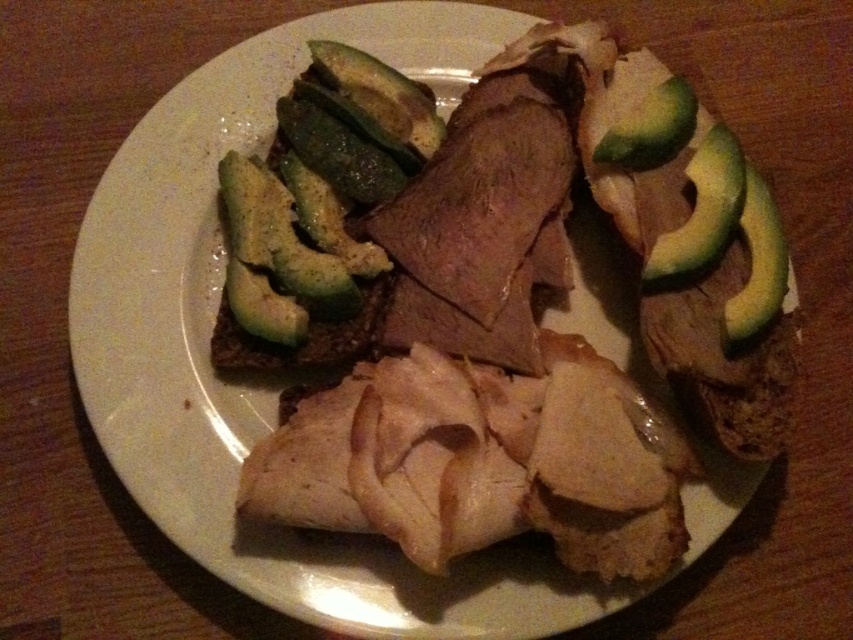
You are a food stylist arranging this plate. You need to place a new garnish between the green smooth avocado at upper right and the green smooth avocado at right. Which avocado is shorter so you can place the garnish in front of it?

The green smooth avocado at upper right is shorter than the green smooth avocado at right, so you should place the garnish in front of the green smooth avocado at upper right.

Consider the image. You are arranging a food platter and need to place both the green smooth avocado at upper right and the green smooth avocado at right. Based on their positions on the plate, which avocado is positioned to the left of the other?

The green smooth avocado at upper right is positioned to the left of the green smooth avocado at right.